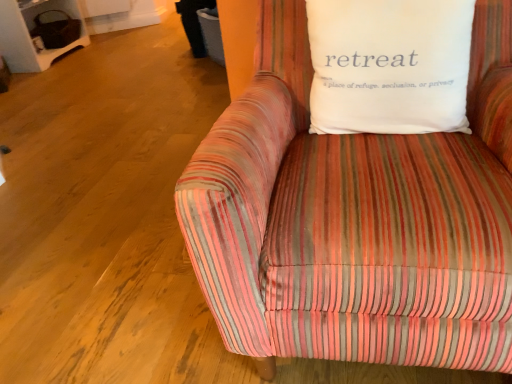
Question: Is striped fabric couch at center wider than white cotton pillow at upper right?

Choices:
 (A) yes
 (B) no

Answer: (A)

Question: Is striped fabric couch at center not inside white cotton pillow at upper right?

Choices:
 (A) yes
 (B) no

Answer: (A)

Question: From a real-world perspective, is striped fabric couch at center on top of white cotton pillow at upper right?

Choices:
 (A) no
 (B) yes

Answer: (A)

Question: Would you say striped fabric couch at center is a long distance from white cotton pillow at upper right?

Choices:
 (A) no
 (B) yes

Answer: (A)

Question: Is striped fabric couch at center oriented towards white cotton pillow at upper right?

Choices:
 (A) no
 (B) yes

Answer: (B)

Question: Can you confirm if striped fabric couch at center is bigger than white cotton pillow at upper right?

Choices:
 (A) yes
 (B) no

Answer: (A)

Question: Would you say white cotton pillow at upper right is outside striped fabric couch at center?

Choices:
 (A) yes
 (B) no

Answer: (B)

Question: Can you confirm if white cotton pillow at upper right is bigger than striped fabric couch at center?

Choices:
 (A) yes
 (B) no

Answer: (B)

Question: Is white cotton pillow at upper right closer to the viewer compared to striped fabric couch at center?

Choices:
 (A) no
 (B) yes

Answer: (A)

Question: Does white cotton pillow at upper right appear on the right side of striped fabric couch at center?

Choices:
 (A) yes
 (B) no

Answer: (B)

Question: Is striped fabric couch at center a part of white cotton pillow at upper right?

Choices:
 (A) no
 (B) yes

Answer: (A)

Question: Does white cotton pillow at upper right have a greater width compared to striped fabric couch at center?

Choices:
 (A) no
 (B) yes

Answer: (A)

Question: Is white cotton pillow at upper right wider or thinner than striped fabric couch at center?

Choices:
 (A) thin
 (B) wide

Answer: (A)